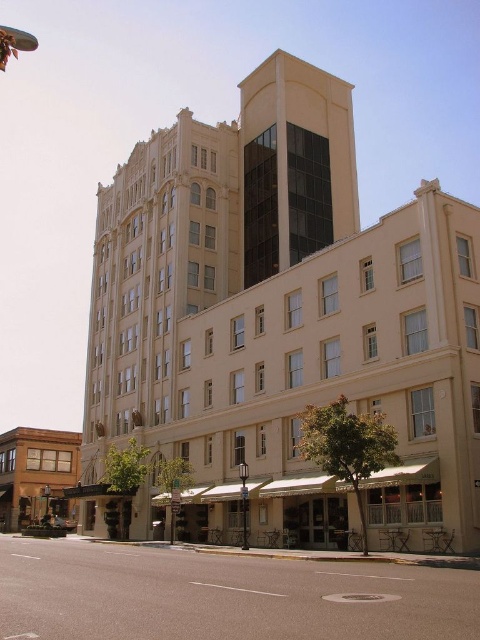
Who is positioned more to the right, beige stone building at center or brown wooden building at lower left?

Positioned to the right is beige stone building at center.

Is beige stone building at center to the right of brown wooden building at lower left from the viewer's perspective?

Correct, you'll find beige stone building at center to the right of brown wooden building at lower left.

Where is `beige stone building at center`? beige stone building at center is located at coordinates (285, 321).